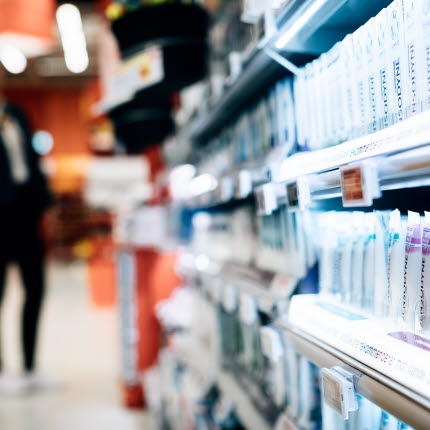
I want to click on white shelf, so click(x=379, y=328).